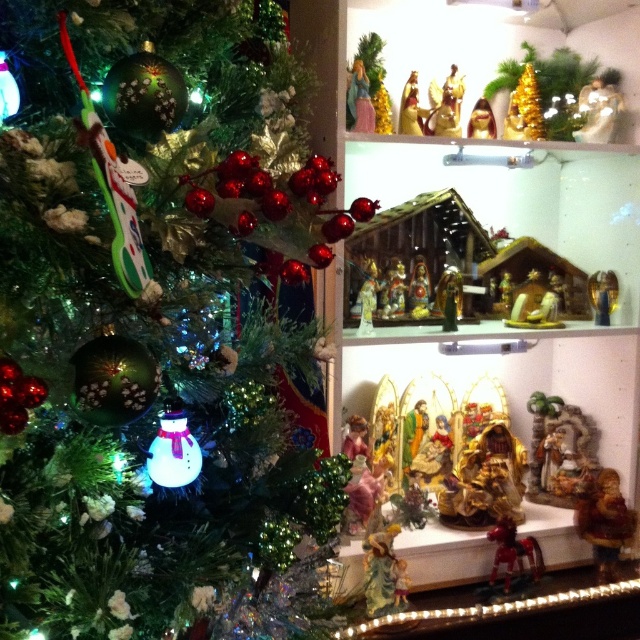
Question: Estimate the real-world distances between objects in this image. Which object is farther from the gold metallic angel at upper center?

Choices:
 (A) gold metallic nativity figure at upper center
 (B) gold metallic nativity set at center
 (C) matte gold angel at center
 (D) gold metallic monkey at upper center

Answer: (C)

Question: Which point is closer to the camera?

Choices:
 (A) (596, 529)
 (B) (371, 115)
 (C) (413, 97)
 (D) (600, 140)

Answer: (B)

Question: Does gold metallic figurine at lower right appear over gold metallic nativity set at upper center?

Choices:
 (A) yes
 (B) no

Answer: (B)

Question: Which of these objects is positioned closest to the gold metallic nativity set at center?

Choices:
 (A) matte gold figurine at upper center
 (B) gold metallic nativity scene at center

Answer: (B)

Question: Does metallic gold horse at lower right appear on the right side of gold metallic nativity figure at upper center?

Choices:
 (A) yes
 (B) no

Answer: (A)

Question: Can you confirm if gold metallic nativity set at upper center is thinner than gold metallic nativity set at center?

Choices:
 (A) yes
 (B) no

Answer: (B)